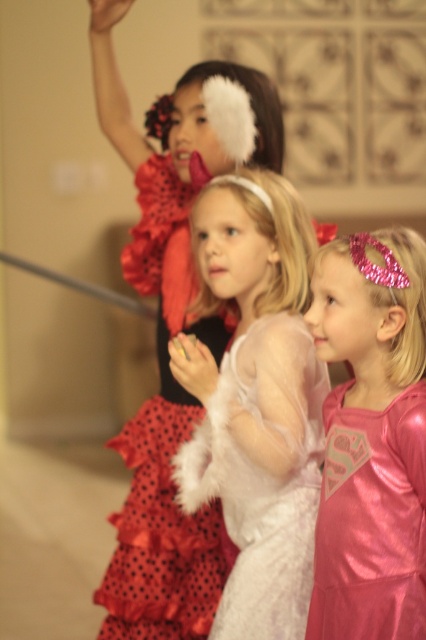
Question: Is the position of white fluffy dress at center less distant than that of pink shiny dress at center?

Choices:
 (A) yes
 (B) no

Answer: (B)

Question: Is matte black dress at upper left closer to the viewer compared to red polka dot fabric ballet skirt at center?

Choices:
 (A) yes
 (B) no

Answer: (B)

Question: Is the position of white fluffy dress at center more distant than that of red polka dot fabric ballet skirt at center?

Choices:
 (A) no
 (B) yes

Answer: (A)

Question: Based on their relative distances, which object is farther from the pink shiny dress at center?

Choices:
 (A) red polka dot fabric ballet skirt at center
 (B) matte black dress at upper left
 (C) white fluffy dress at center

Answer: (B)

Question: Which of the following is the closest to the observer?

Choices:
 (A) (146, 454)
 (B) (244, 636)
 (C) (373, 557)

Answer: (C)

Question: Estimate the real-world distances between objects in this image. Which object is farther from the white fluffy dress at center?

Choices:
 (A) red polka dot fabric ballet skirt at center
 (B) pink shiny dress at center

Answer: (A)